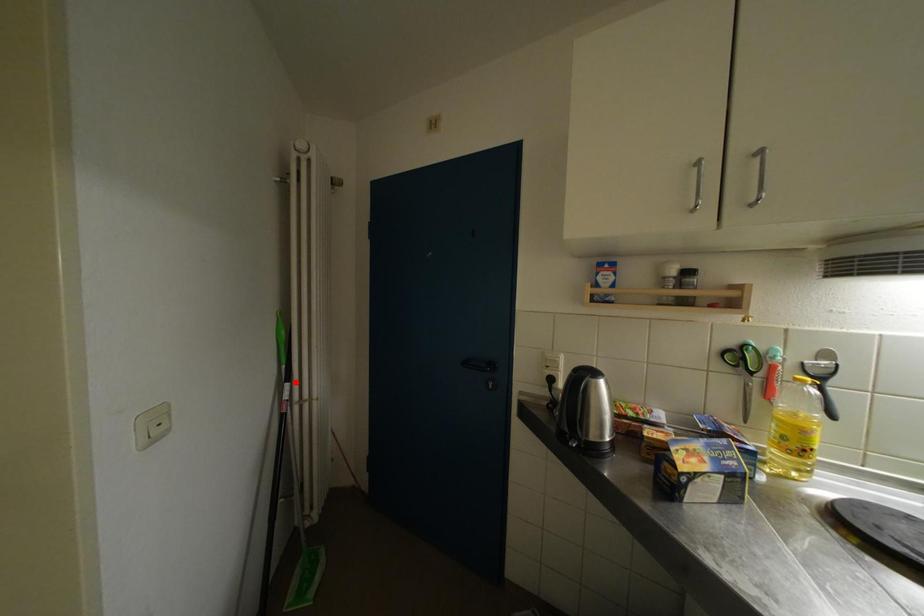
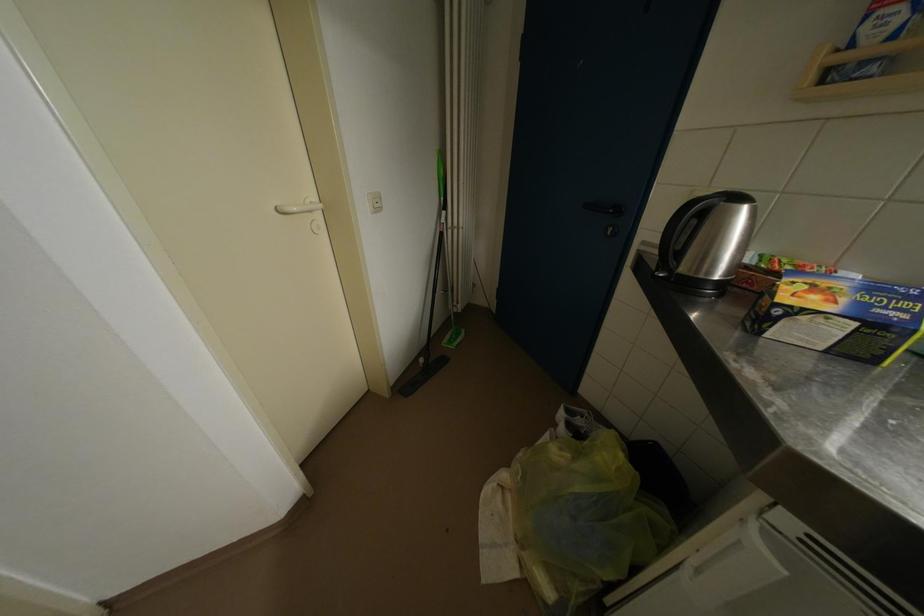
Question: I am providing you with two images of the same scene from different viewpoints. Given a red point in image1, look at the same physical point in image2. Is it:

Choices:
 (A) Closer to the viewpoint
 (B) Farther from the viewpoint

Answer: (A)